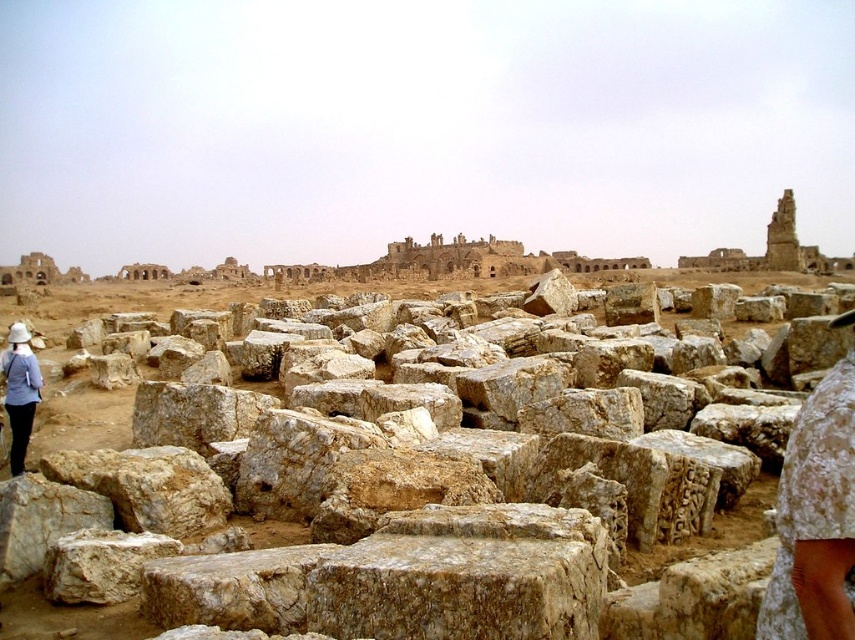
You are an archaeologist examining the site. You notice the natural stone blocks at center and the light blue fabric hat at left. Which object is taller?

The natural stone blocks at center are taller than the light blue fabric hat at left according to the description.